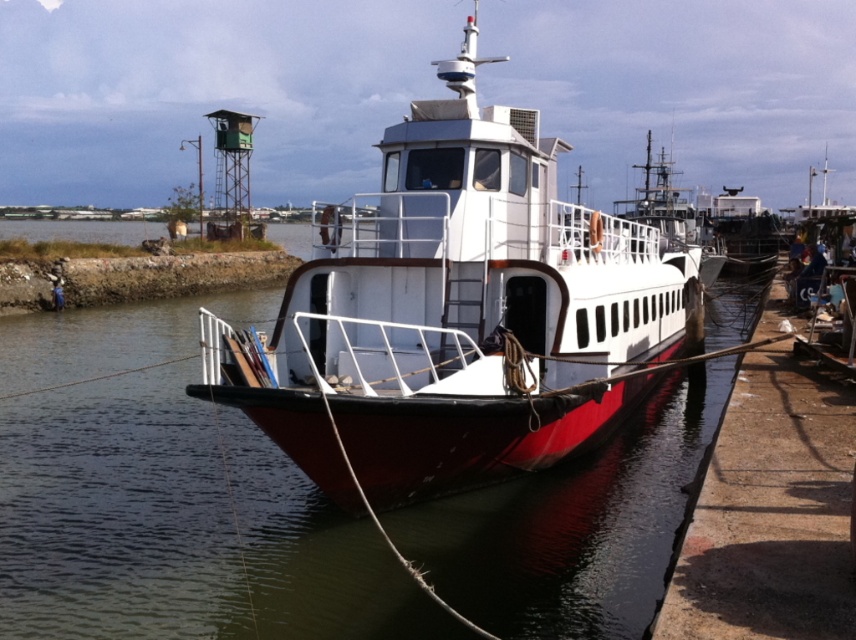
Question: Which of the following is the farthest from the observer?

Choices:
 (A) white glossy ferry at center
 (B) red matte boat at center

Answer: (A)

Question: Which of these objects is positioned closest to the glossy water at center?

Choices:
 (A) white glossy ferry at center
 (B) red matte boat at center

Answer: (B)

Question: Is red matte boat at center above white glossy ferry at center?

Choices:
 (A) no
 (B) yes

Answer: (A)

Question: Is glossy water at center smaller than white glossy ferry at center?

Choices:
 (A) no
 (B) yes

Answer: (B)

Question: Where is glossy water at center located in relation to red matte boat at center in the image?

Choices:
 (A) above
 (B) below

Answer: (B)

Question: Considering the real-world distances, which object is closest to the white glossy ferry at center?

Choices:
 (A) glossy water at center
 (B) red matte boat at center

Answer: (B)